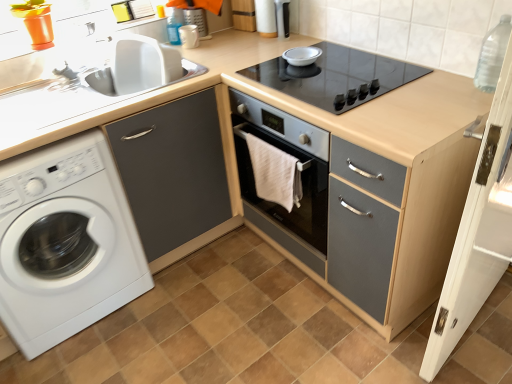
Question: Considering the positions of white wood screen door at right and white glossy sink at upper left in the image, is white wood screen door at right wider or thinner than white glossy sink at upper left?

Choices:
 (A) thin
 (B) wide

Answer: (A)

Question: Is white wood screen door at right situated inside white glossy sink at upper left or outside?

Choices:
 (A) outside
 (B) inside

Answer: (A)

Question: Which is nearer to the metallic silver toaster at upper center, which is the 2th appliance from left to right?

Choices:
 (A) white wood screen door at right
 (B) transparent plastic bottle at upper right
 (C) white matte washing machine at left
 (D) white towel at center
 (E) white glossy sink at upper left

Answer: (D)

Question: Considering the real-world distances, which object is closest to the matte gray cabinet at center?

Choices:
 (A) matte gray cabinet at left
 (B) transparent plastic bottle at upper right
 (C) matte white mug at upper center, the second appliance when ordered from right to left
 (D) white towel at center
 (E) metallic silver toaster at upper center, which is the 2th appliance from left to right

Answer: (D)